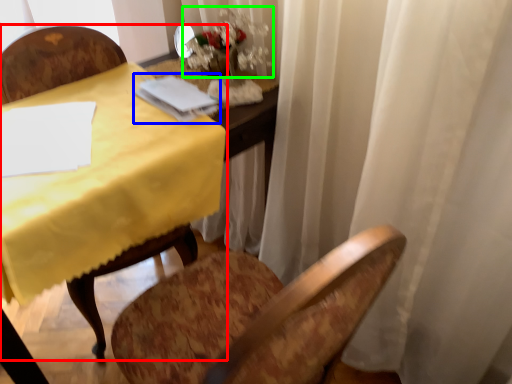
Question: Which is nearer to the chair (highlighted by a red box)? notebook (highlighted by a blue box) or floral arrangement (highlighted by a green box).

Choices:
 (A) notebook
 (B) floral arrangement

Answer: (A)